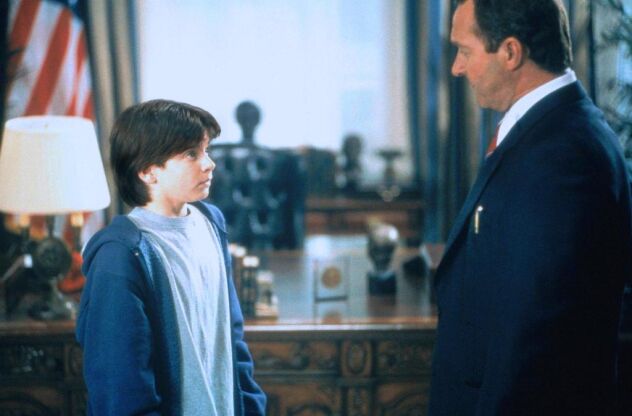
What are the coordinates of `lamp` in the screenshot? It's located at (68, 212).